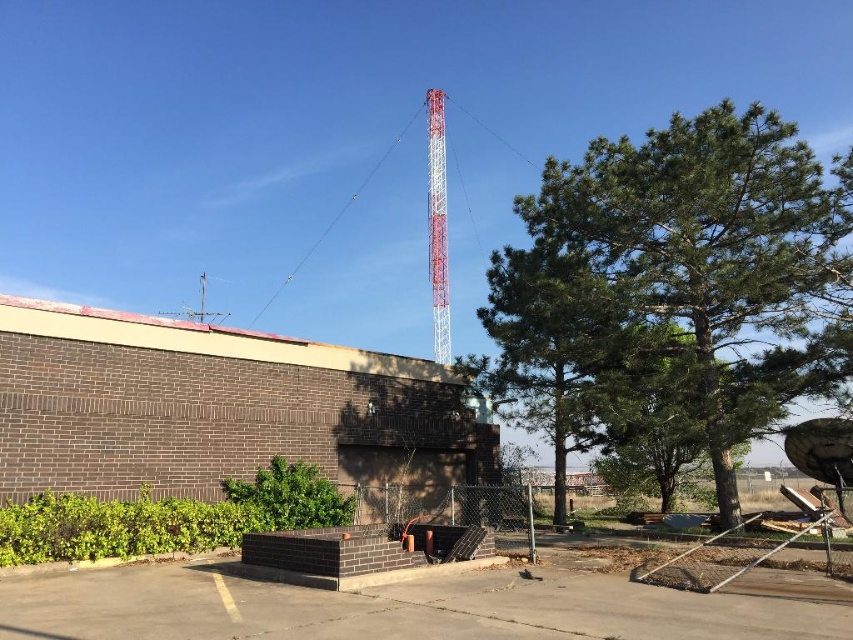
Can you confirm if green leafy tree at center is wider than metallic pole at center?

Indeed, green leafy tree at center has a greater width compared to metallic pole at center.

Is green leafy tree at center taller than metallic pole at center?

Yes.

In the scene shown: Who is more distant from viewer, (490, 307) or (532, 529)?

Point (490, 307)

This screenshot has height=640, width=853. What are the coordinates of `green leafy tree at center` in the screenshot? It's located at (675, 280).

Is green leafy tree at center positioned before metallic red tower at upper center?

Yes, green leafy tree at center is closer to the viewer.

Image resolution: width=853 pixels, height=640 pixels. I want to click on green leafy tree at center, so click(x=675, y=280).

This screenshot has height=640, width=853. In order to click on green leafy tree at center in this screenshot , I will do `click(675, 280)`.

Is metallic red tower at upper center wider than metallic pole at center?

Indeed, metallic red tower at upper center has a greater width compared to metallic pole at center.

Does point (445, 256) come behind point (527, 556)?

Yes, point (445, 256) is behind point (527, 556).

Is point (434, 108) less distant than point (532, 541)?

That is False.

Identify the location of metallic red tower at upper center. Image resolution: width=853 pixels, height=640 pixels. (437, 225).